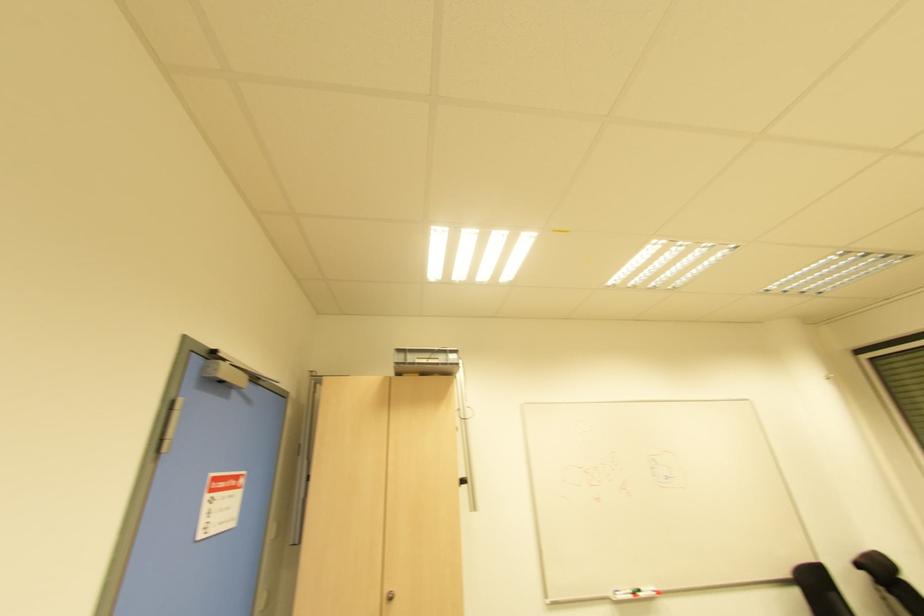
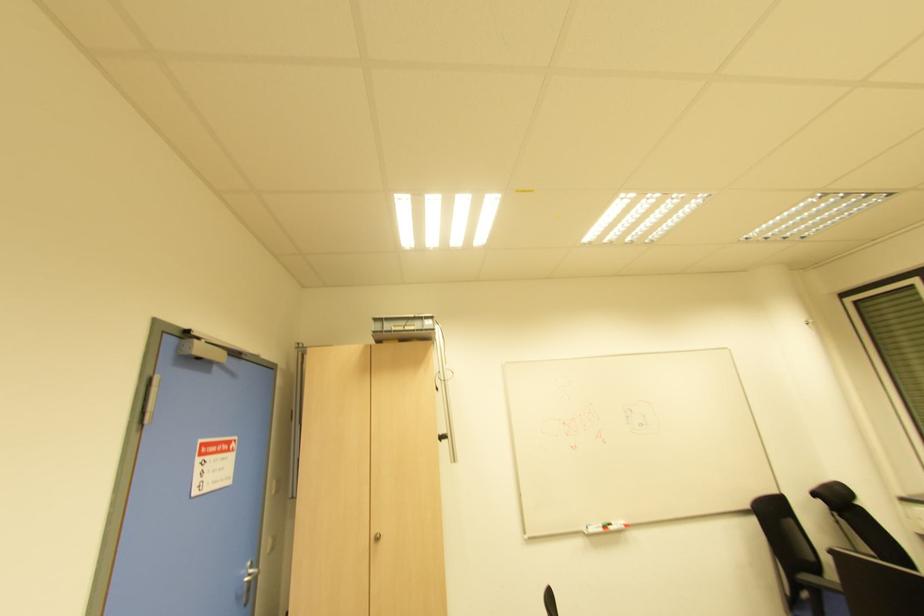
Question: How did the camera likely rotate?

Choices:
 (A) Left
 (B) Right
 (C) Up
 (D) Down

Answer: (D)